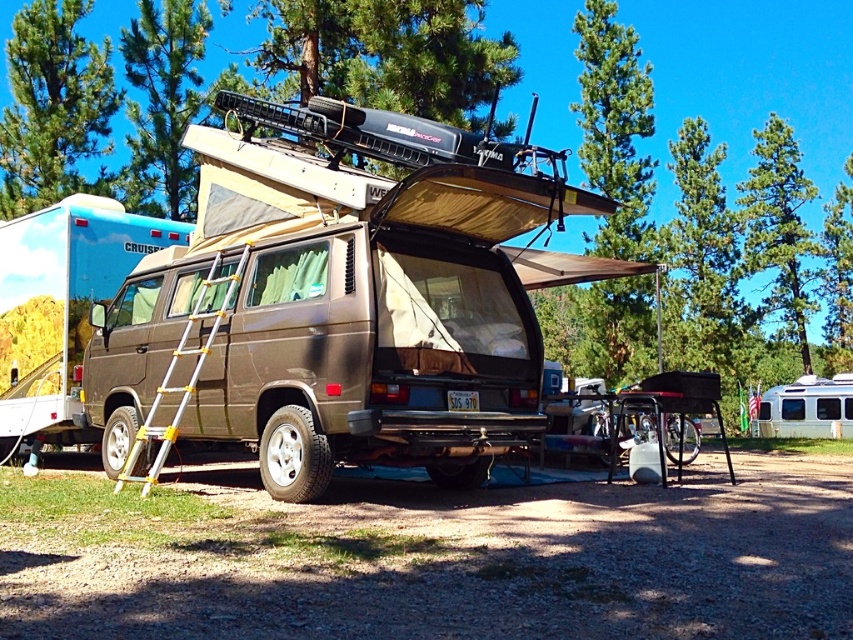
You are standing in front of the van and want to take a photo of both the point at coordinates point (41,300) and point (144,420). Which point should you focus on first to ensure both are in focus?

You should focus on point (41,300) first because it is closer to the camera than point (144,420), ensuring both points are within the depth of field.

You are using a GPS navigation system and need to mark the location of the brown matte van at center. What are the coordinates where it is located?

The brown matte van at center is located at coordinates point (x=61, y=301).